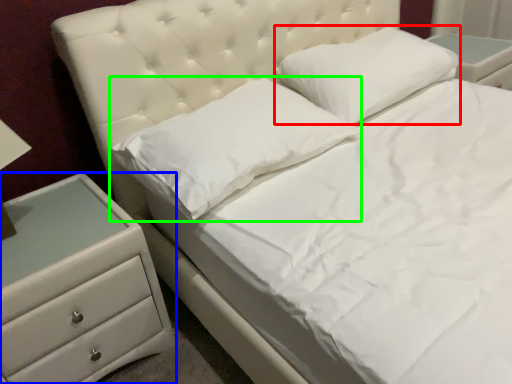
Question: Which object is positioned farthest from pillow (highlighted by a red box)? Select from chest of drawers (highlighted by a blue box) and pillow (highlighted by a green box).

Choices:
 (A) chest of drawers
 (B) pillow

Answer: (A)